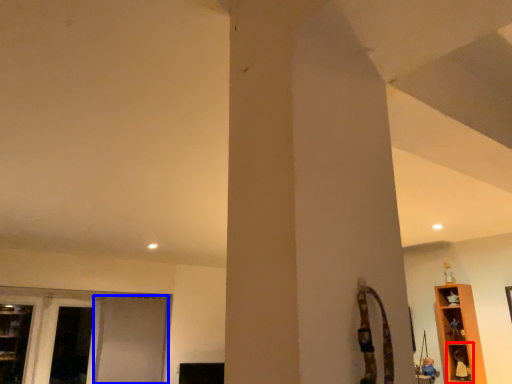
Question: Among these objects, which one is nearest to the camera, shelf (highlighted by a red box) or screen door (highlighted by a blue box)?

Choices:
 (A) shelf
 (B) screen door

Answer: (A)